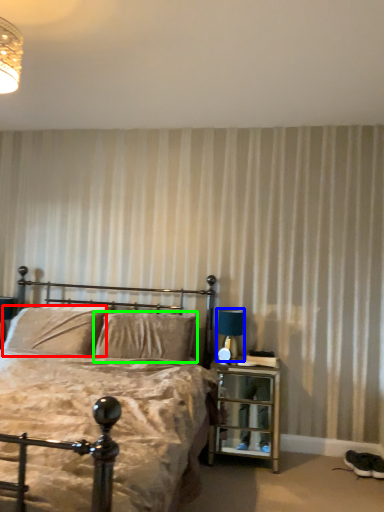
Question: Which object is positioned closest to pillow (highlighted by a red box)? Select from table lamp (highlighted by a blue box) and pillow (highlighted by a green box).

Choices:
 (A) table lamp
 (B) pillow

Answer: (B)